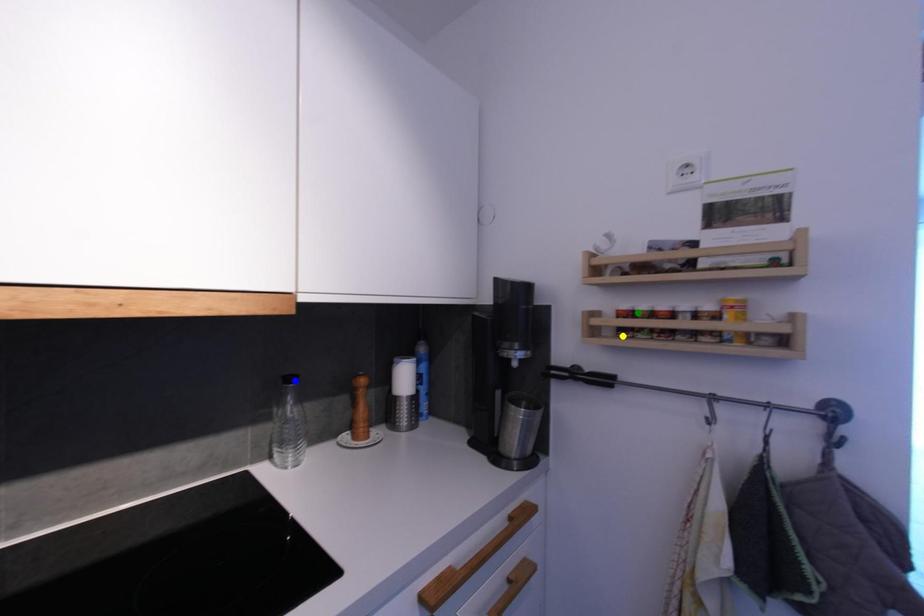
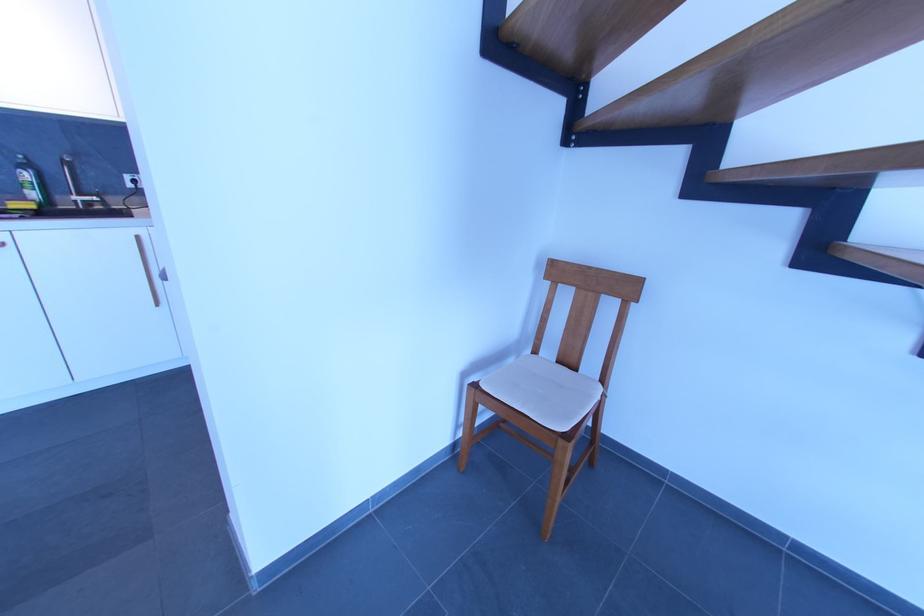
I am providing you with two images of the same scene from different viewpoints. Three points are marked in image1. Which point corresponds to a part or object that is occluded in image2?In image1, three points are marked. Which of them correspond to a part or object that is occluded in image2?Among the three points shown in image1, which one corresponds to a part or object that is no longer visible due to occlusion in image2?

Invisible in image2: blue point, green point, yellow point.